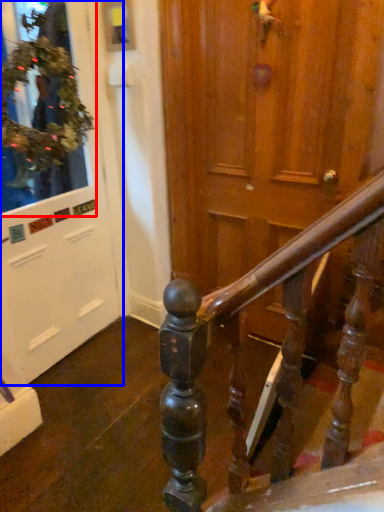
Question: Which object appears farthest to the camera in this image, shop window (highlighted by a red box) or door (highlighted by a blue box)?

Choices:
 (A) shop window
 (B) door

Answer: (A)